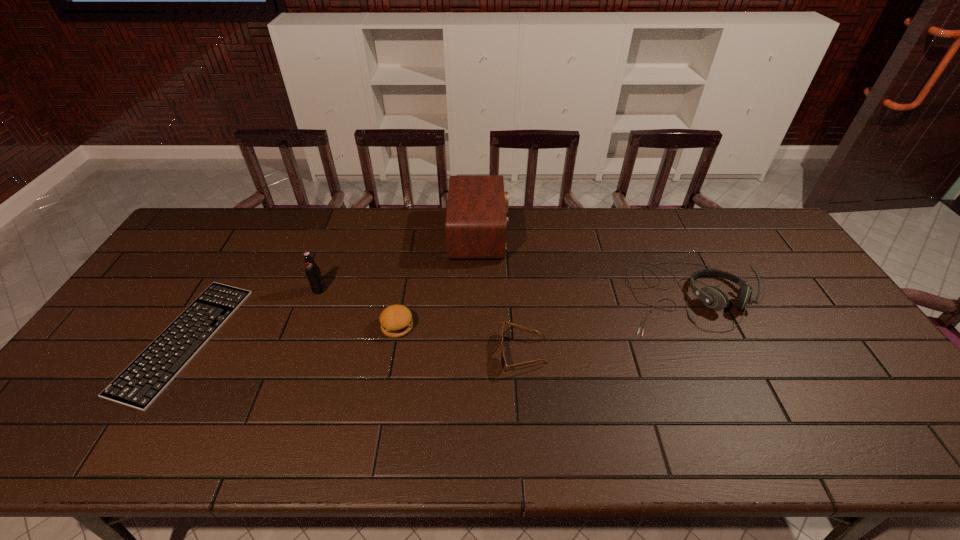
Locate an element on the screen. The height and width of the screenshot is (540, 960). vacant area between the second shortest object and the computer keyboard is located at coordinates (353, 347).

The width and height of the screenshot is (960, 540). I want to click on free area in between the pop and the leftmost object, so click(252, 315).

The height and width of the screenshot is (540, 960). Identify the location of empty location between the fifth object from right to left and the fifth tallest object. (420, 321).

Image resolution: width=960 pixels, height=540 pixels. What are the coordinates of `object that stands as the second closest to the sunglasses` in the screenshot? It's located at (714, 298).

Locate an element on the screen. This screenshot has width=960, height=540. object that is the third closest to the fifth tallest object is located at coordinates (476, 224).

Locate an element on the screen. The height and width of the screenshot is (540, 960). blank area in the image that satisfies the following two spatial constraints: 1. on the front panel of the radio receiver; 2. on the front label of the second object from left to right is located at coordinates (479, 290).